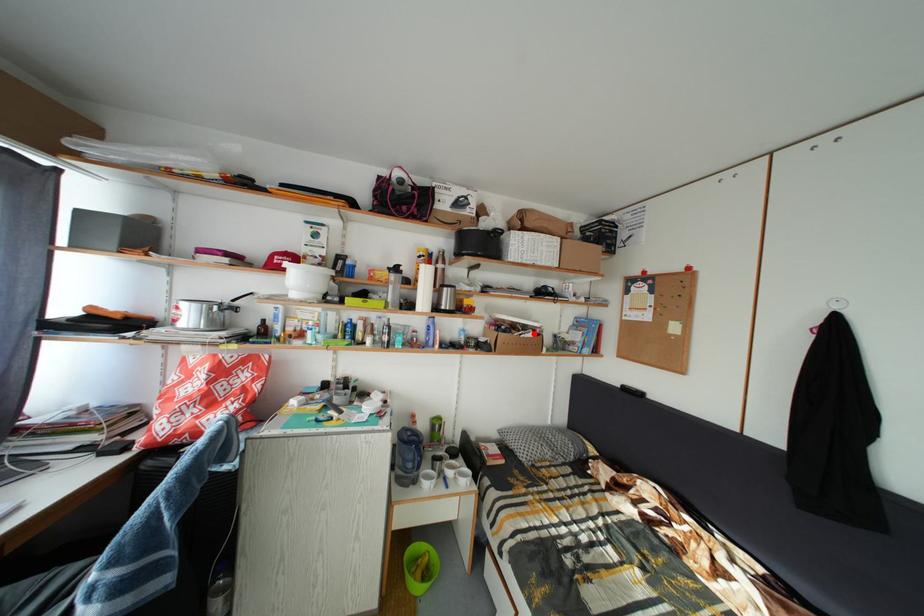
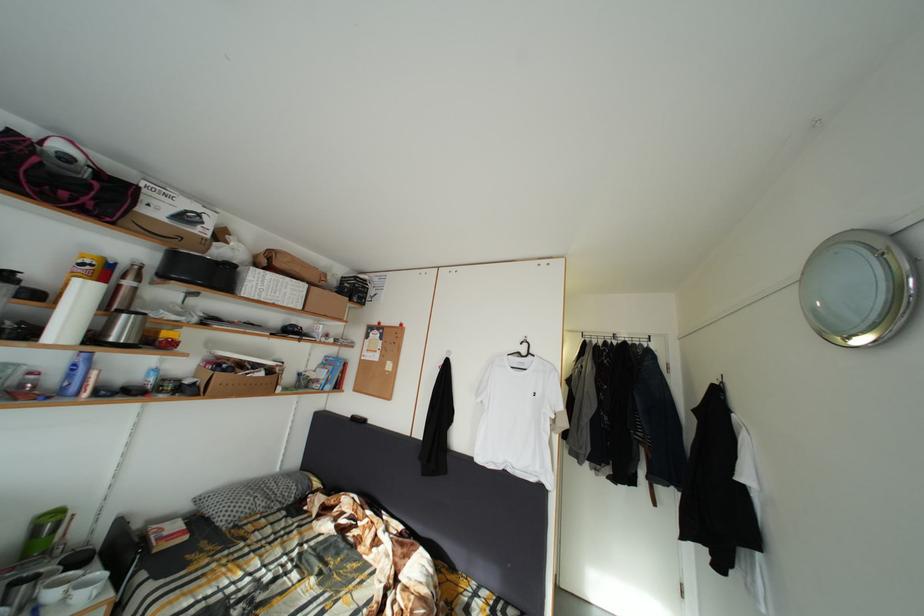
Find the pixel in the second image that matches the highlighted location in the first image.

(264, 373)